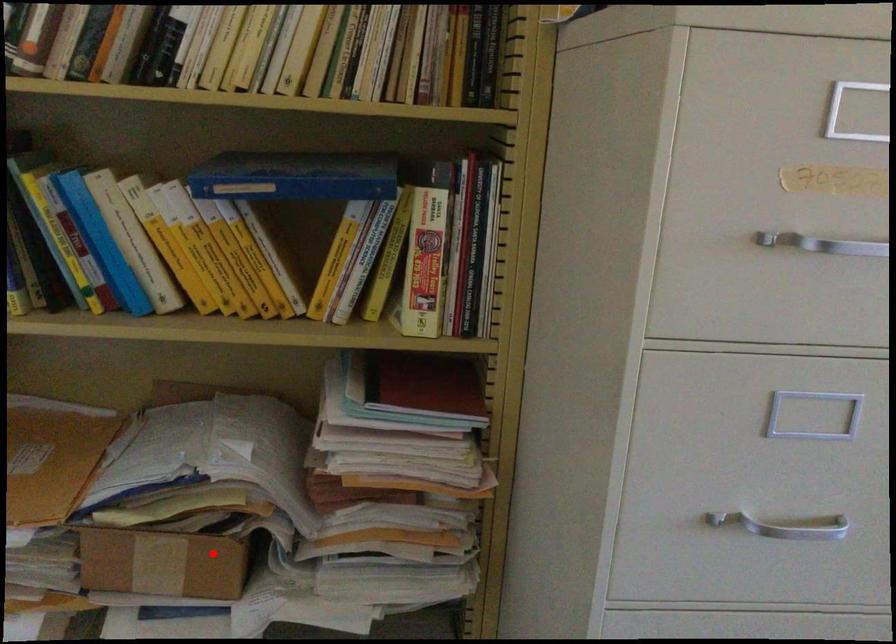
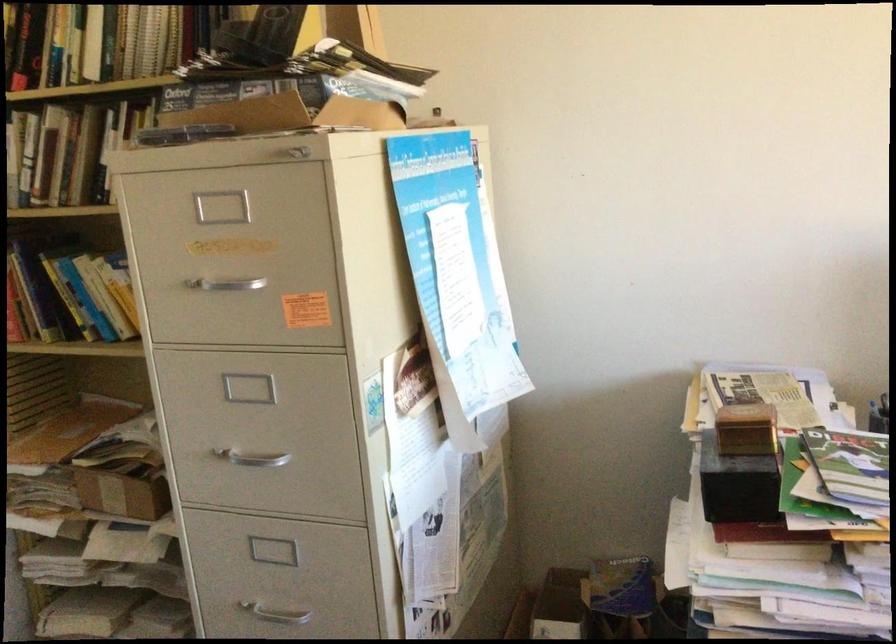
Locate, in the second image, the point that corresponds to the highlighted location in the first image.

(123, 488)